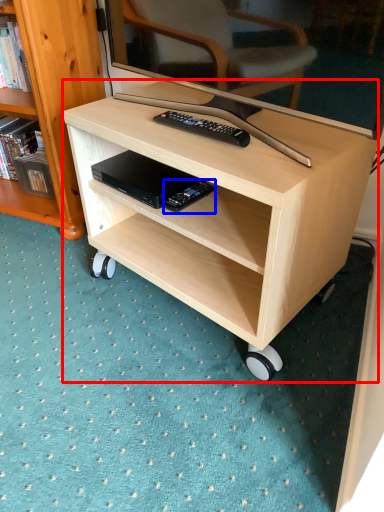
Question: Among these objects, which one is nearest to the camera, desk (highlighted by a red box) or equipment (highlighted by a blue box)?

Choices:
 (A) desk
 (B) equipment

Answer: (A)